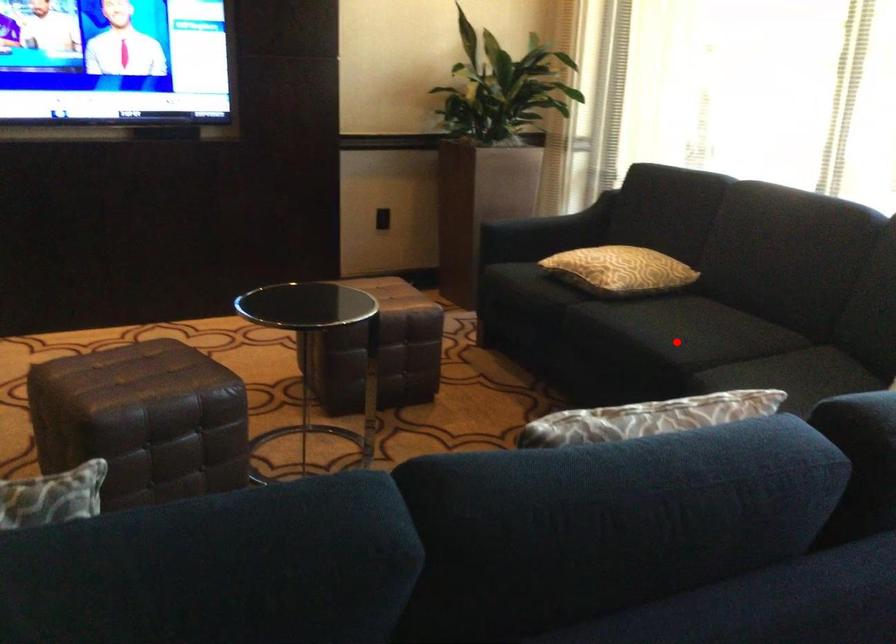
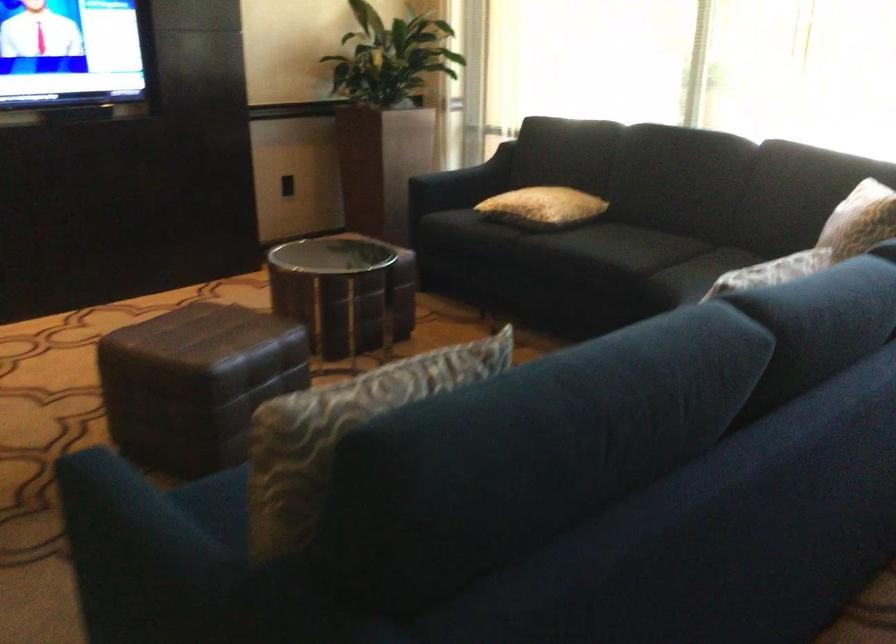
Question: I am providing you with two images of the same scene from different viewpoints. Image1 has a red point marked. In image2, the corresponding 3D location appears at what relative position? Reply with the corresponding letter.

Choices:
 (A) Closer
 (B) Farther

Answer: (B)